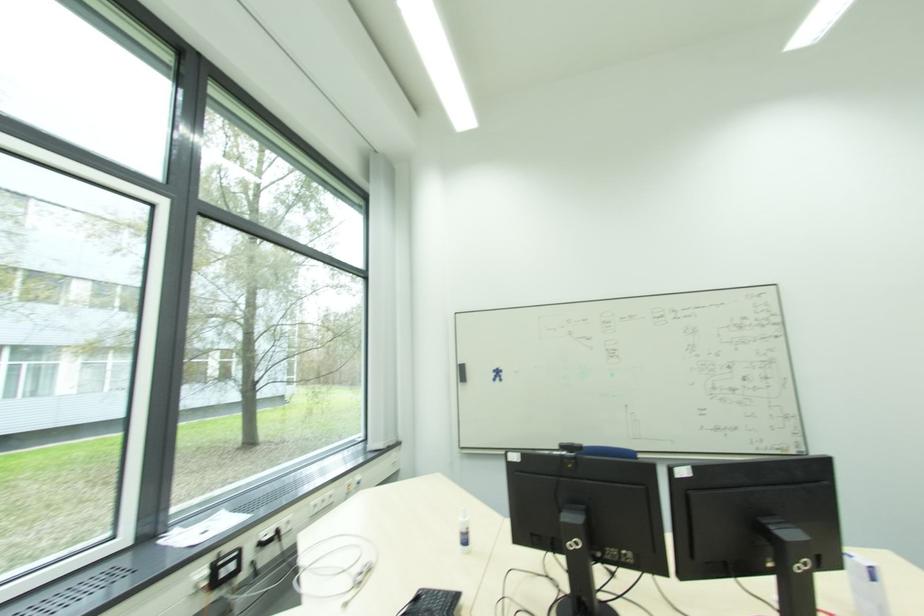
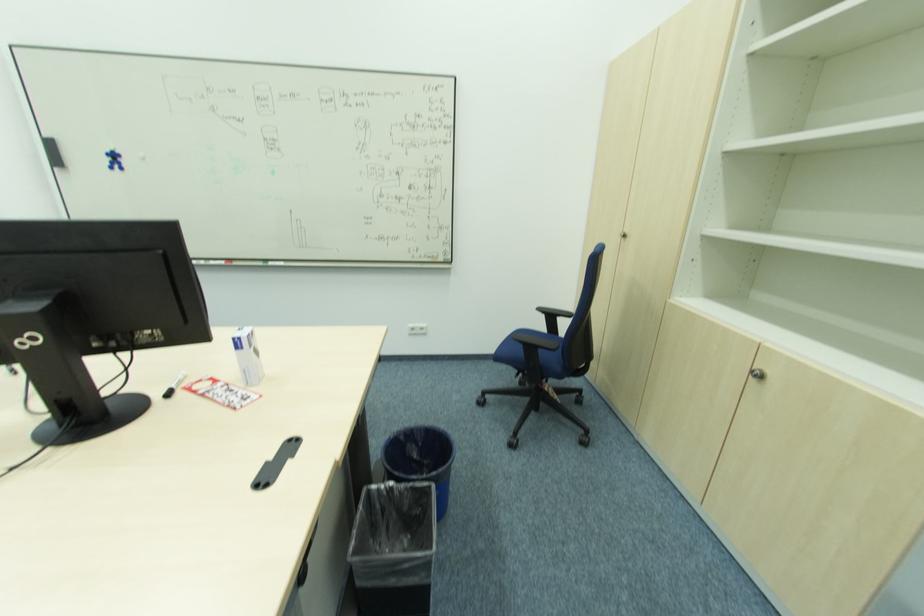
The point at (497, 377) is marked in the first image. Where is the corresponding point in the second image?

(116, 161)